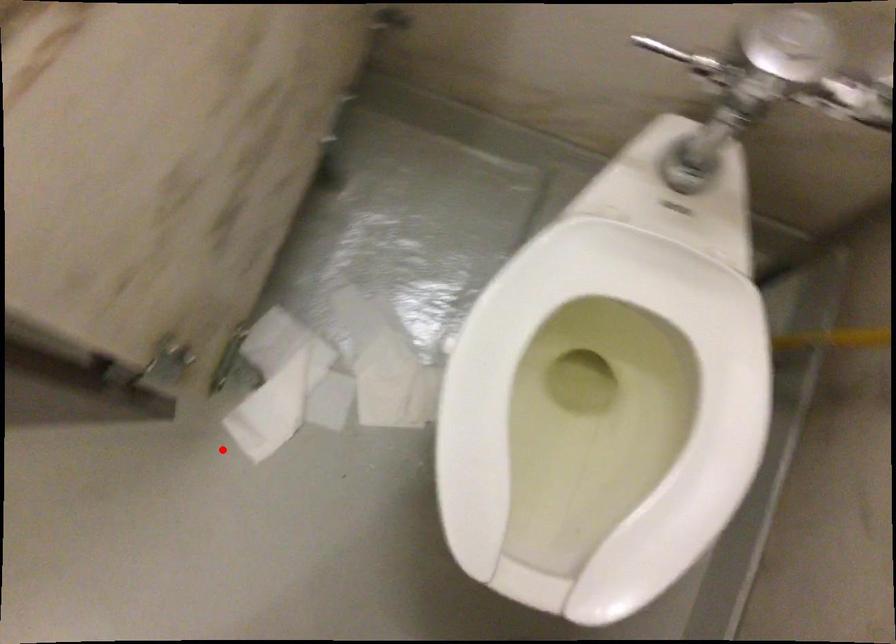
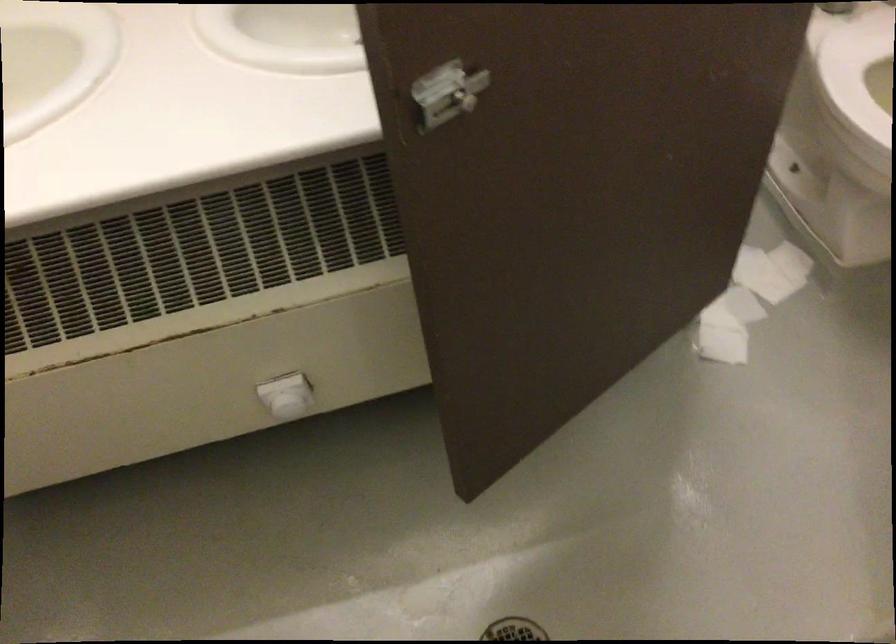
Question: I am providing you with two images of the same scene from different viewpoints. Given a red point in image1, look at the same physical point in image2. Is it:

Choices:
 (A) Closer to the viewpoint
 (B) Farther from the viewpoint

Answer: (B)